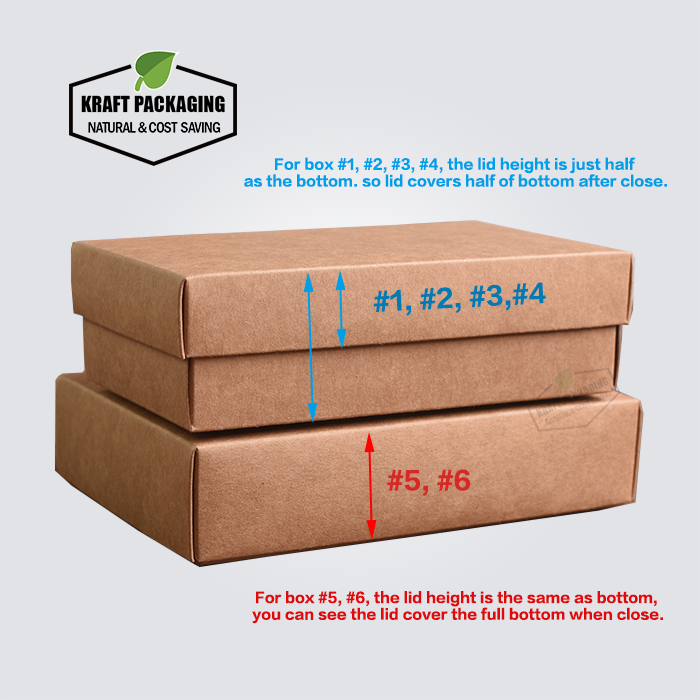
This screenshot has width=700, height=700. What are the coordinates of `box with lid on top` in the screenshot? It's located at (370, 318), (371, 360).